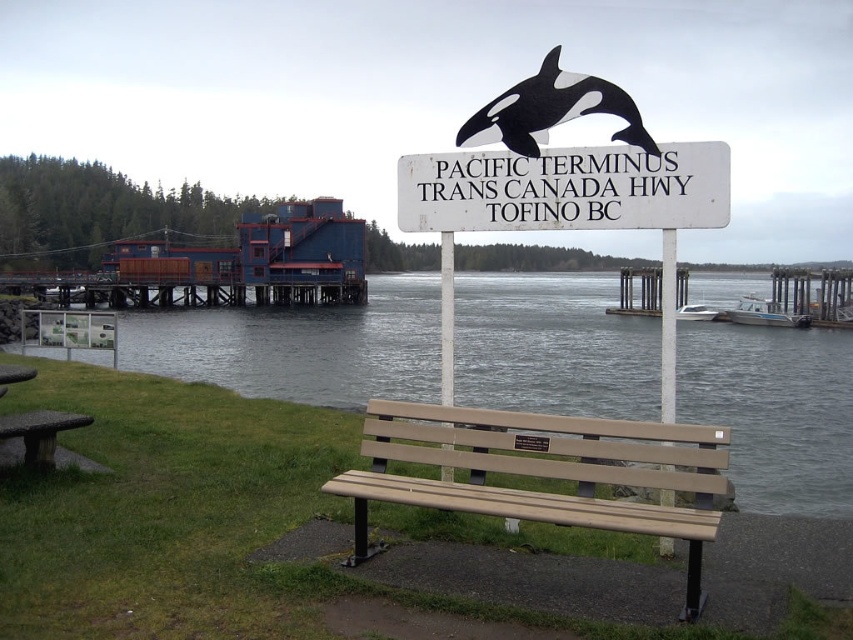
You are a photographer setting up a tripod between the clear water at bench right and the tan plastic bench at center. Since you want to capture both objects in your shot, can you position the tripod so it doesn

The clear water at bench right is wider than the tan plastic bench at center. Therefore, the tripod can be placed between them as there is sufficient space between the two objects.

You are planning to set up a small picnic for two people. Given the scene described, which object would be more suitable for seating? Please choose between the tan plastic bench at center and the stone textured picnic table at lower left.

The tan plastic bench at center is bigger than the stone textured picnic table at lower left, making it more suitable for seating two people.